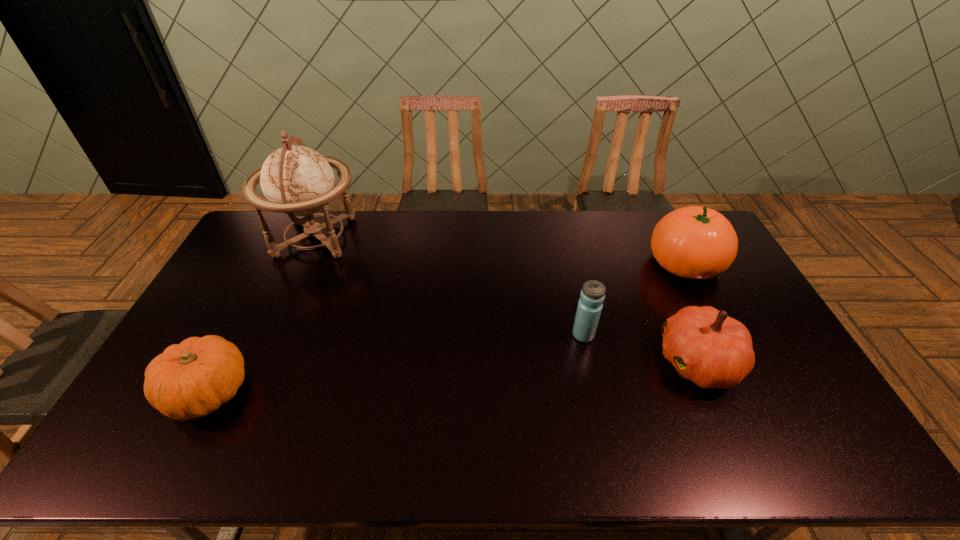
Where is `blank area at the right edge`? blank area at the right edge is located at coordinates (793, 361).

In the image, there is a desktop. In order to click on vacant space at the far right corner in this screenshot , I will do `click(668, 211)`.

Find the location of a particular element. This screenshot has height=540, width=960. blank region between the third object from right to left and the farthest pumpkin is located at coordinates (635, 299).

Identify the location of vacant area between the shortest object and the globe. This screenshot has width=960, height=540. (262, 314).

Locate an element on the screen. The image size is (960, 540). free spot between the farthest pumpkin and the shortest pumpkin is located at coordinates (446, 327).

What are the coordinates of `free point between the tallest object and the farthest pumpkin` in the screenshot? It's located at (500, 250).

Where is `free space between the water bottle and the shortest pumpkin`? This screenshot has width=960, height=540. free space between the water bottle and the shortest pumpkin is located at coordinates (396, 363).

The image size is (960, 540). I want to click on vacant region between the third object from left to right and the farthest pumpkin, so click(x=635, y=299).

At what (x,y) coordinates should I click in order to perform the action: click on unoccupied position between the third object from right to left and the farthest pumpkin. Please return your answer as a coordinate pair (x, y). Looking at the image, I should click on (635, 299).

You are a GUI agent. You are given a task and a screenshot of the screen. Output one action in this format:
    pyautogui.click(x=<x>, y=<y>)
    Task: Click on the free point between the farthest pumpkin and the shortest pumpkin
    The width and height of the screenshot is (960, 540).
    Given the screenshot: What is the action you would take?
    pyautogui.click(x=446, y=327)